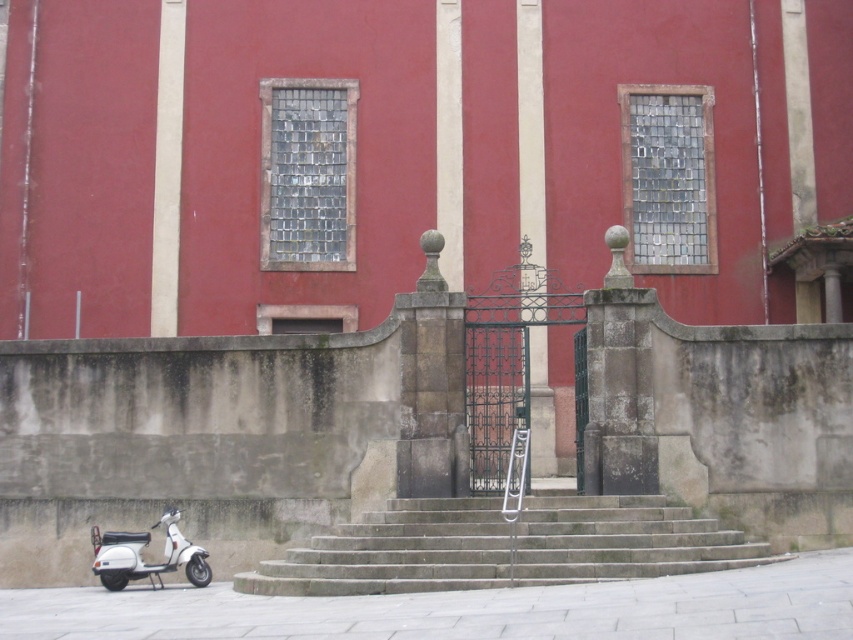
You are standing in front of the building and want to enter through the metal gate. Which direction should you walk to reach the gray stone stairs at center?

Walk towards the gray stone stairs at center located at point (395, 552) to reach them and proceed towards the metal gate.

You are standing in front of the building and want to enter through the gate. You see a gray stone stairs at center and a white matte scooter at lower left. Which object is closer to the gate?

The gray stone stairs at center is positioned on the right side of white matte scooter at lower left, so the white matte scooter at lower left is closer to the gate since it is to the left of the stairs.